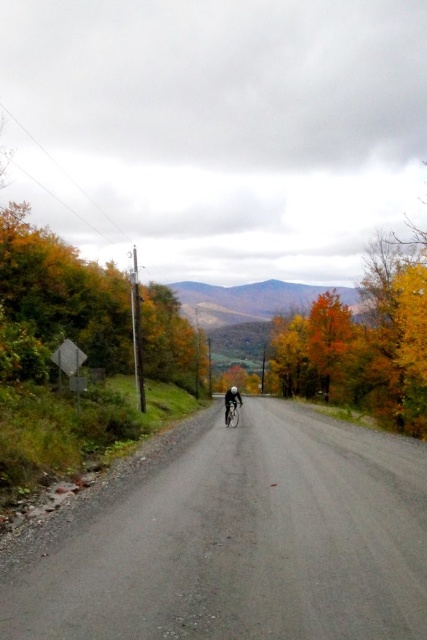
Question: Does yellow leafy tree at center appear over shiny metallic bicycle at center?

Choices:
 (A) no
 (B) yes

Answer: (B)

Question: Which object is the farthest from the yellow leafy tree at center?

Choices:
 (A) shiny metallic bicycle at center
 (B) gray gravel road at center

Answer: (A)

Question: Observing the image, what is the correct spatial positioning of gray gravel road at center in reference to shiny metallic bicycle at center?

Choices:
 (A) below
 (B) above

Answer: (B)

Question: Which point is closer to the camera?

Choices:
 (A) coord(391,308)
 (B) coord(202,604)

Answer: (B)

Question: Is gray gravel road at center to the right of yellow leafy tree at center from the viewer's perspective?

Choices:
 (A) yes
 (B) no

Answer: (B)

Question: Which object is closer to the camera taking this photo?

Choices:
 (A) gray gravel road at center
 (B) yellow leafy tree at center

Answer: (A)